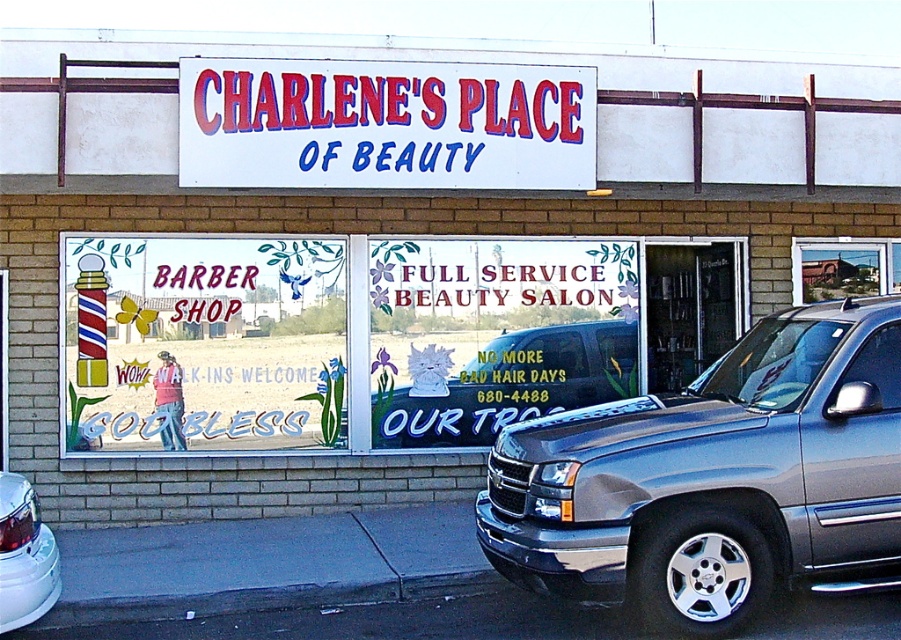
Is point (48, 557) more distant than point (845, 291)?

No, (48, 557) is in front of (845, 291).

Between white glossy car at lower left and metallic silver car at center, which one appears on the right side from the viewer's perspective?

From the viewer's perspective, metallic silver car at center appears more on the right side.

Who is more distant from viewer, [29,532] or [865,257]?

The point [865,257] is more distant.

Locate an element on the screen. Image resolution: width=901 pixels, height=640 pixels. white glossy car at lower left is located at coordinates (24, 556).

Is point (523, 172) in front of point (43, 589)?

No, (523, 172) is behind (43, 589).

I want to click on white plastic sign at center, so click(385, 124).

Is metallic gray suv at center taller than matte black pickup truck at center?

Correct, metallic gray suv at center is much taller as matte black pickup truck at center.

Between point (681, 477) and point (590, 307), which one is positioned in front?

Positioned in front is point (681, 477).

Who is more forward, (639, 524) or (544, 244)?

Point (639, 524) is in front.

Identify the location of metallic gray suv at center. This screenshot has width=901, height=640. (715, 480).